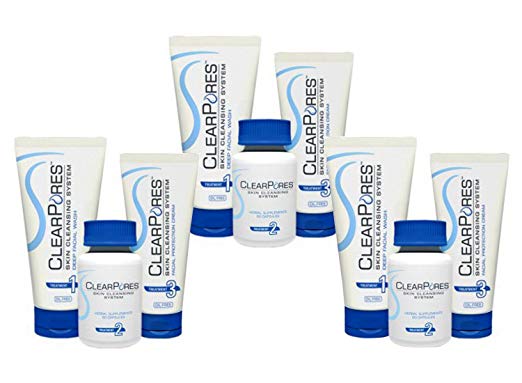
Find the location of `pill bottle`. pill bottle is located at coordinates (105, 299), (442, 295).